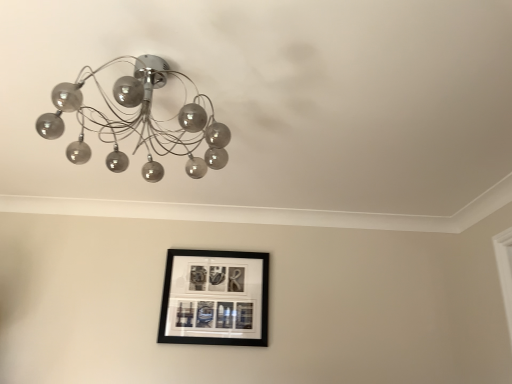
This screenshot has width=512, height=384. I want to click on black matte picture frame at lower center, so click(215, 298).

Image resolution: width=512 pixels, height=384 pixels. What do you see at coordinates (215, 298) in the screenshot?
I see `black matte picture frame at lower center` at bounding box center [215, 298].

Describe the element at coordinates (138, 121) in the screenshot. The width and height of the screenshot is (512, 384). I see `satin silver chandelier at upper left` at that location.

Where is `satin silver chandelier at upper left`? satin silver chandelier at upper left is located at coordinates (138, 121).

This screenshot has height=384, width=512. Find the location of `black matte picture frame at lower center`. black matte picture frame at lower center is located at coordinates (215, 298).

Is black matte picture frame at lower center to the right of satin silver chandelier at upper left from the viewer's perspective?

Indeed, black matte picture frame at lower center is positioned on the right side of satin silver chandelier at upper left.

Between black matte picture frame at lower center and satin silver chandelier at upper left, which one is positioned in front?

satin silver chandelier at upper left.

Which is in front, point (163, 307) or point (138, 76)?

The point (138, 76) is in front.

From the image's perspective, who appears lower, black matte picture frame at lower center or satin silver chandelier at upper left?

From the image's view, black matte picture frame at lower center is below.

From a real-world perspective, who is located lower, black matte picture frame at lower center or satin silver chandelier at upper left?

black matte picture frame at lower center, from a real-world perspective.

Does black matte picture frame at lower center have a greater width compared to satin silver chandelier at upper left?

No, black matte picture frame at lower center is not wider than satin silver chandelier at upper left.

Which of these two, black matte picture frame at lower center or satin silver chandelier at upper left, stands taller?

black matte picture frame at lower center.

Considering the sizes of objects black matte picture frame at lower center and satin silver chandelier at upper left in the image provided, who is bigger, black matte picture frame at lower center or satin silver chandelier at upper left?

satin silver chandelier at upper left.

Based on the photo, is black matte picture frame at lower center outside of satin silver chandelier at upper left?

black matte picture frame at lower center lies outside satin silver chandelier at upper left's area.

Would you consider black matte picture frame at lower center to be distant from satin silver chandelier at upper left?

No, black matte picture frame at lower center is in close proximity to satin silver chandelier at upper left.

Could you tell me if black matte picture frame at lower center is turned towards satin silver chandelier at upper left?

Yes, black matte picture frame at lower center faces towards satin silver chandelier at upper left.

How many degrees apart are the facing directions of black matte picture frame at lower center and satin silver chandelier at upper left?

black matte picture frame at lower center and satin silver chandelier at upper left are facing 94.5 degrees away from each other.

Locate an element on the screen. This screenshot has height=384, width=512. lamp on the left of black matte picture frame at lower center is located at coordinates pos(138,121).

Visually, is satin silver chandelier at upper left positioned to the left or to the right of black matte picture frame at lower center?

In the image, satin silver chandelier at upper left appears on the left side of black matte picture frame at lower center.

Which object is closer to the camera, satin silver chandelier at upper left or black matte picture frame at lower center?

satin silver chandelier at upper left is closer to the camera.

Considering the positions of points (142, 169) and (206, 259), is point (142, 169) closer to camera compared to point (206, 259)?

Yes, it is in front of point (206, 259).

From the image's perspective, is satin silver chandelier at upper left above or below black matte picture frame at lower center?

satin silver chandelier at upper left is above black matte picture frame at lower center.

From a real-world perspective, is satin silver chandelier at upper left above or below black matte picture frame at lower center?

Clearly, from a real-world perspective, satin silver chandelier at upper left is above black matte picture frame at lower center.

Can you confirm if satin silver chandelier at upper left is wider than black matte picture frame at lower center?

Yes, satin silver chandelier at upper left is wider than black matte picture frame at lower center.

Considering the relative sizes of satin silver chandelier at upper left and black matte picture frame at lower center in the image provided, is satin silver chandelier at upper left taller than black matte picture frame at lower center?

Incorrect, the height of satin silver chandelier at upper left is not larger of that of black matte picture frame at lower center.

Considering the relative sizes of satin silver chandelier at upper left and black matte picture frame at lower center in the image provided, is satin silver chandelier at upper left smaller than black matte picture frame at lower center?

No, satin silver chandelier at upper left is not smaller than black matte picture frame at lower center.

Can we say satin silver chandelier at upper left lies outside black matte picture frame at lower center?

Absolutely, satin silver chandelier at upper left is external to black matte picture frame at lower center.

Is there a large distance between satin silver chandelier at upper left and black matte picture frame at lower center?

They are positioned close to each other.

Is satin silver chandelier at upper left positioned with its back to black matte picture frame at lower center?

No.

How different are the orientations of satin silver chandelier at upper left and black matte picture frame at lower center in degrees?

There is a 94.5-degree angle between the facing directions of satin silver chandelier at upper left and black matte picture frame at lower center.

Locate an element on the screen. The width and height of the screenshot is (512, 384). picture frame below the satin silver chandelier at upper left (from the image's perspective) is located at coordinates (215, 298).

This screenshot has width=512, height=384. I want to click on picture frame below the satin silver chandelier at upper left (from a real-world perspective), so click(215, 298).

I want to click on lamp to the left of black matte picture frame at lower center, so click(x=138, y=121).